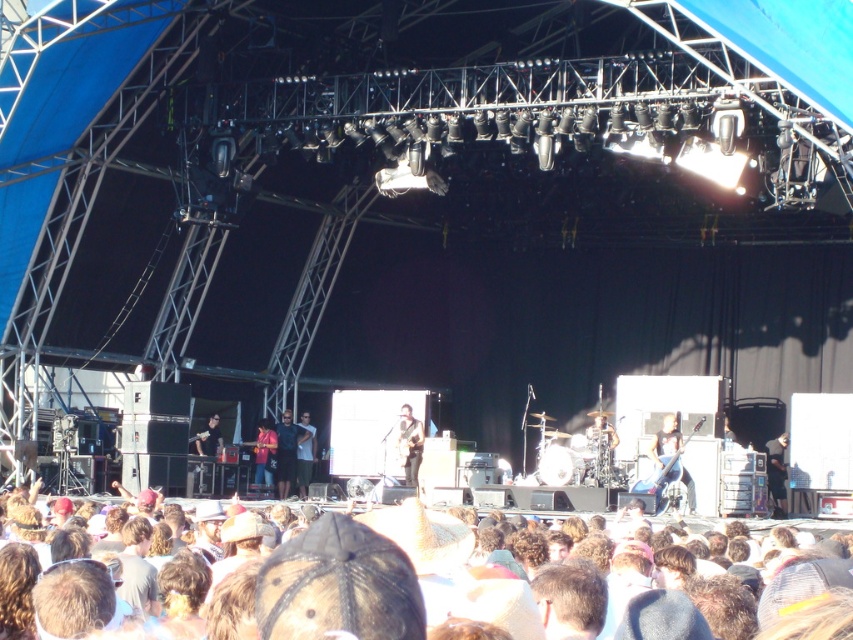
You are a photographer at the concert aiming to capture a clear shot of the dark blue jeans at center and the white shirt at center. Which one should you focus on first if you want to ensure both are in focus, considering their heights?

The dark blue jeans at center is not as tall as white shirt at center, so you should focus on the white shirt at center first since it is taller and might require a different focal plane.

You are a photographer at the concert. You need to capture a clear photo of the light brown hair at lower center and dark blue jeans at lower left. Which object should you zoom in more on to ensure clarity?

The light brown hair at lower center has a larger size compared to dark blue jeans at lower left, so you should zoom in more on the dark blue jeans at lower left to ensure clarity.